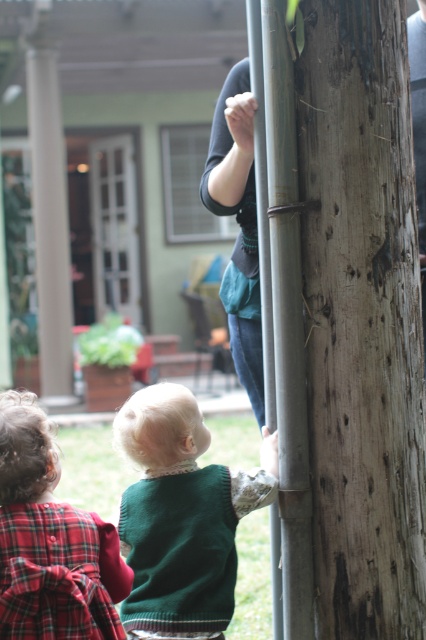
Consider the image. Is silver metallic pole at center above plaid fabric dress at lower left?

Yes, silver metallic pole at center is above plaid fabric dress at lower left.

Can you confirm if silver metallic pole at center is taller than plaid fabric dress at lower left?

Yes, silver metallic pole at center is taller than plaid fabric dress at lower left.

The width and height of the screenshot is (426, 640). I want to click on silver metallic pole at center, so click(282, 308).

Does wooden textured tree trunk at right appear on the left side of silver metallic pole at center?

In fact, wooden textured tree trunk at right is to the right of silver metallic pole at center.

Who is positioned more to the left, wooden textured tree trunk at right or silver metallic pole at center?

From the viewer's perspective, silver metallic pole at center appears more on the left side.

At what (x,y) coordinates should I click in order to perform the action: click on wooden textured tree trunk at right. Please return your answer as a coordinate pair (x, y). The width and height of the screenshot is (426, 640). Looking at the image, I should click on (354, 316).

The height and width of the screenshot is (640, 426). In order to click on wooden textured tree trunk at right in this screenshot , I will do `click(354, 316)`.

Is point (325, 339) positioned in front of point (170, 493)?

Yes, point (325, 339) is in front of point (170, 493).

Looking at this image, which of these two, wooden textured tree trunk at right or green knitted sweater at center, stands shorter?

green knitted sweater at center

Does point (331, 241) come behind point (209, 538)?

No, (331, 241) is in front of (209, 538).

The height and width of the screenshot is (640, 426). What are the coordinates of `wooden textured tree trunk at right` in the screenshot? It's located at (354, 316).